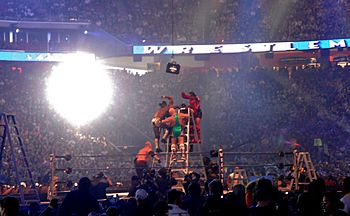
I want to click on bright light, so click(91, 94).